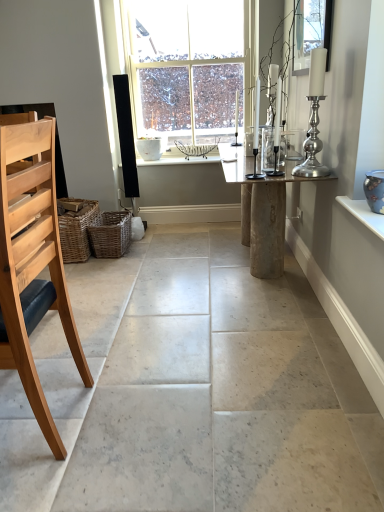
This screenshot has height=512, width=384. Find the location of `free space to the back side of silver metallic candle holder at upper right`. free space to the back side of silver metallic candle holder at upper right is located at coordinates (286, 169).